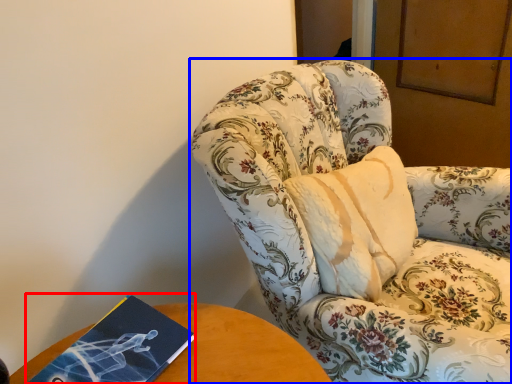
Question: Which object is closer to the camera taking this photo, paperback book (highlighted by a red box) or chair (highlighted by a blue box)?

Choices:
 (A) paperback book
 (B) chair

Answer: (B)